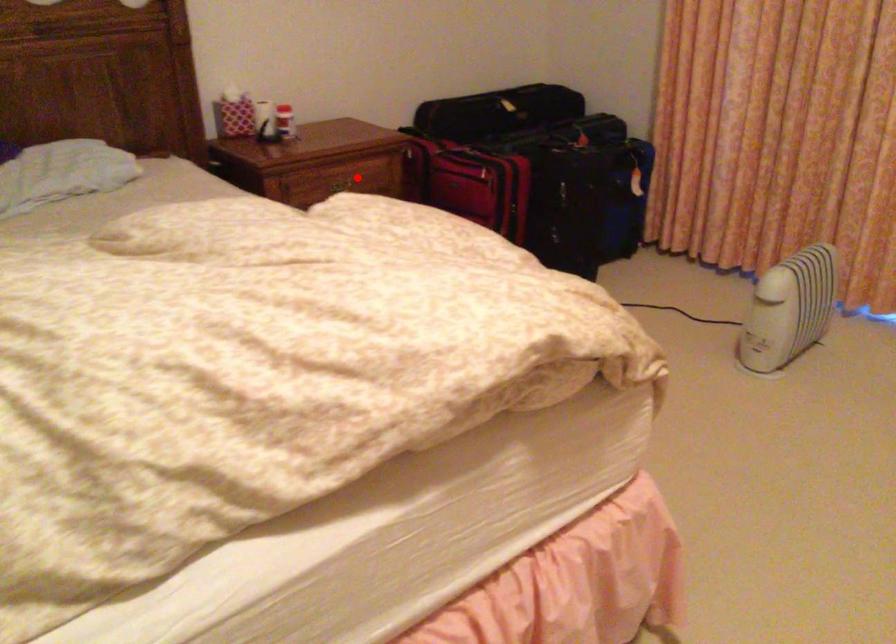
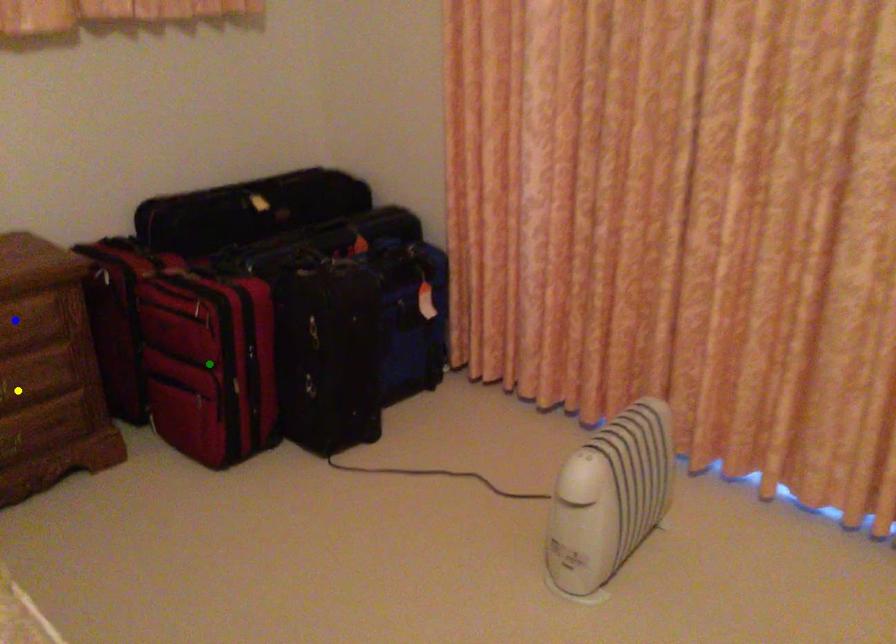
Question: I am providing you with two images of the same scene from different viewpoints. A red point is marked on the first image. You are given multiple points on the second image. Which mark in image 2 goes with the point in image 1?

Choices:
 (A) yellow point
 (B) green point
 (C) blue point

Answer: (C)